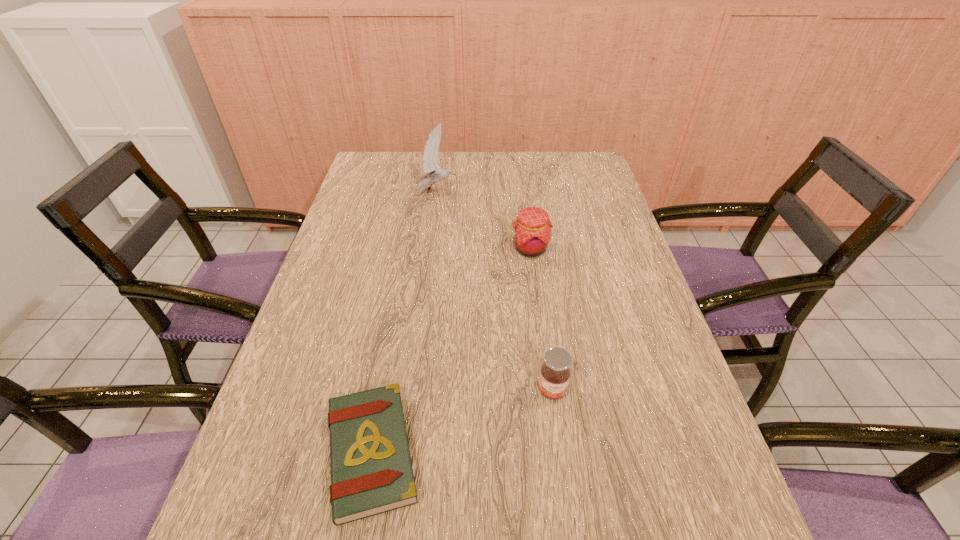
The image size is (960, 540). In order to click on vacant region between the third nearest object and the nearer jam in this screenshot , I will do `click(541, 320)`.

Identify the location of free spot between the farther jam and the farthest object. This screenshot has width=960, height=540. (484, 221).

Locate an element on the screen. empty space between the book and the nearer jam is located at coordinates (462, 421).

The height and width of the screenshot is (540, 960). Identify the location of empty location between the third nearest object and the nearer jam. (541, 320).

Find the location of a particular element. free spot between the farther jam and the book is located at coordinates coord(450,350).

Where is `unoccupied area between the farthest object and the shortest object`? The image size is (960, 540). unoccupied area between the farthest object and the shortest object is located at coordinates (404, 322).

Point out which object is positioned as the nearest to the nearer jam. Please provide its 2D coordinates. Your answer should be formatted as a tuple, i.e. [(x, y)], where the tuple contains the x and y coordinates of a point satisfying the conditions above.

[(371, 470)]

Select which object appears as the closest to the gull. Please provide its 2D coordinates. Your answer should be formatted as a tuple, i.e. [(x, y)], where the tuple contains the x and y coordinates of a point satisfying the conditions above.

[(532, 229)]

Where is `blank area in the image that satisfies the following two spatial constraints: 1. at the tip of the beak of the gull; 2. on the front side of the book`? The image size is (960, 540). blank area in the image that satisfies the following two spatial constraints: 1. at the tip of the beak of the gull; 2. on the front side of the book is located at coordinates (402, 452).

You are a GUI agent. You are given a task and a screenshot of the screen. Output one action in this format:
    pyautogui.click(x=<x>, y=<y>)
    Task: Click on the free space that satisfies the following two spatial constraints: 1. at the tip of the beak of the gull; 2. on the back side of the second farthest object
    The width and height of the screenshot is (960, 540).
    Given the screenshot: What is the action you would take?
    pyautogui.click(x=429, y=249)